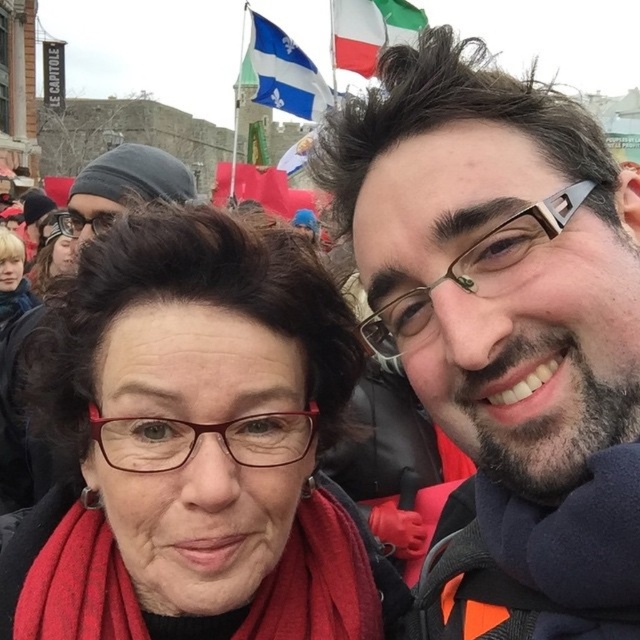
You are standing in the crowd at this event and notice two points marked in the image. Which point, point (467, 625) or point (250, 42), is closer to you?

Point (467, 625) is closer to the viewer than point (250, 42).